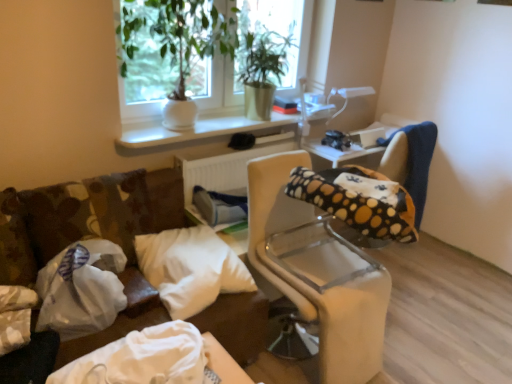
Question: In terms of width, does green leafy plant at upper center look wider or thinner when compared to white soft pillow at center?

Choices:
 (A) thin
 (B) wide

Answer: (A)

Question: From the image's perspective, is green leafy plant at upper center positioned above or below white soft pillow at center?

Choices:
 (A) below
 (B) above

Answer: (B)

Question: Based on their relative distances, which object is nearer to the white plastic radiator at center?

Choices:
 (A) beige fabric chair at center
 (B) green matte plant at upper center
 (C) white soft pillow at center
 (D) white fabric bag at lower left
 (E) white plastic bag at left

Answer: (C)

Question: Which object is positioned farthest from the green leafy plant at upper center?

Choices:
 (A) white soft pillow at center
 (B) green matte plant at upper center
 (C) white glossy window sill at upper center
 (D) polka dot fabric bean bag chair at right
 (E) white fabric bag at lower left

Answer: (E)